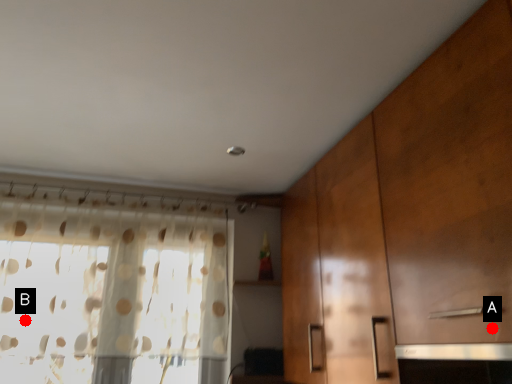
Question: Two points are circled on the image, labeled by A and B beside each circle. Which point is closer to the camera?

Choices:
 (A) A is closer
 (B) B is closer

Answer: (A)